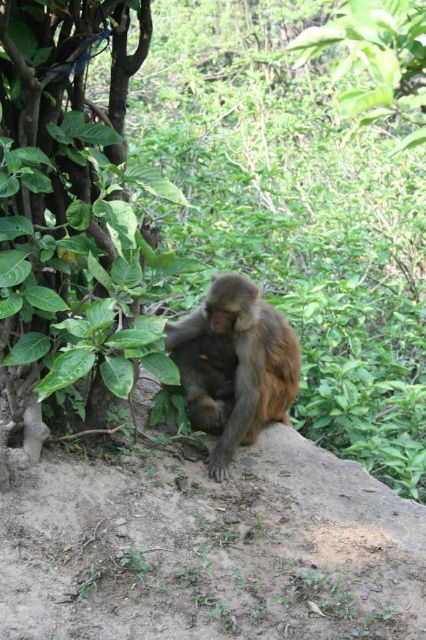
From the picture: You are a hiker who wants to take a photo of the monkey on the rock. You notice a green leafy tree at left at point (74,212). Is the tree blocking your view of the monkey?

The green leafy tree at left at point (74,212) is located at that specific coordinate, but since the monkey is on a flat, light colored rock which is elevated or positioned in such a way that it might not be obscured by the tree. However, without exact spatial relations beyond the given data, we can infer based on typical scenarios. Since the tree is at the left and the monkey is on the rock in the midst of greenery, it is possible the tree could be blocking part of the view depending on the angle. But,

You are a photographer taking a picture of the monkey. You notice two points in the scene labeled as point (43, 360) and point (279, 340). Which point is nearer to your camera lens?

Point (43, 360) is closer to the camera than point (279, 340).

You are a hiker who wants to take a photo of the brown furry monkey at center. To get a clear shot, you need to ensure the green leafy tree at left isn

The green leafy tree at left is larger than the brown furry monkey at center, so positioning yourself so the tree doesn